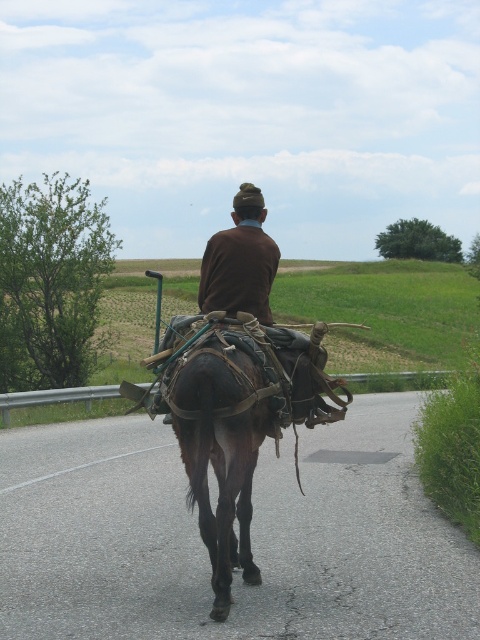
Question: Which of the following is the farthest from the observer?

Choices:
 (A) asphalt road at center
 (B) brown leather horse at center
 (C) brown wool sweater at center

Answer: (C)

Question: Which of the following is the farthest from the observer?

Choices:
 (A) (207, 253)
 (B) (247, 442)
 (C) (358, 632)

Answer: (A)

Question: Is asphalt road at center further to the viewer compared to brown wool sweater at center?

Choices:
 (A) yes
 (B) no

Answer: (B)

Question: Among these points, which one is farthest from the camera?

Choices:
 (A) (62, 435)
 (B) (239, 484)

Answer: (A)

Question: Does asphalt road at center have a greater width compared to brown wool sweater at center?

Choices:
 (A) yes
 (B) no

Answer: (A)

Question: Can you confirm if asphalt road at center is positioned below brown wool sweater at center?

Choices:
 (A) no
 (B) yes

Answer: (B)